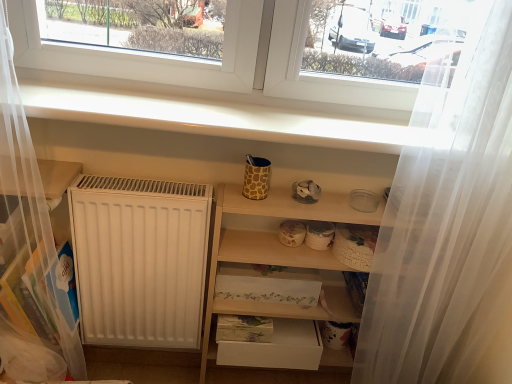
Question: Could you tell me if wooden shelves at center is facing white matte drawer at lower center?

Choices:
 (A) no
 (B) yes

Answer: (B)

Question: Does wooden shelves at center have a greater height compared to white matte drawer at lower center?

Choices:
 (A) yes
 (B) no

Answer: (A)

Question: Is wooden shelves at center placed right next to white matte drawer at lower center?

Choices:
 (A) yes
 (B) no

Answer: (B)

Question: Is wooden shelves at center positioned behind white matte drawer at lower center?

Choices:
 (A) yes
 (B) no

Answer: (B)

Question: Does wooden shelves at center appear on the left side of white matte drawer at lower center?

Choices:
 (A) no
 (B) yes

Answer: (A)

Question: Considering the positions of point (412, 215) and point (327, 203), is point (412, 215) closer or farther from the camera than point (327, 203)?

Choices:
 (A) closer
 (B) farther

Answer: (A)

Question: Is white sheer curtain at right taller or shorter than wooden shelves at center?

Choices:
 (A) short
 (B) tall

Answer: (B)

Question: From the image's perspective, is white sheer curtain at right located above or below wooden shelves at center?

Choices:
 (A) above
 (B) below

Answer: (A)

Question: Is white sheer curtain at right spatially inside wooden shelves at center, or outside of it?

Choices:
 (A) inside
 (B) outside

Answer: (B)

Question: From the image's perspective, relative to white smooth window sill at upper center, is wooden shelves at center above or below?

Choices:
 (A) above
 (B) below

Answer: (B)

Question: Is wooden shelves at center inside or outside of white smooth window sill at upper center?

Choices:
 (A) outside
 (B) inside

Answer: (A)

Question: Is wooden shelves at center taller or shorter than white smooth window sill at upper center?

Choices:
 (A) tall
 (B) short

Answer: (A)

Question: Is point (305, 205) closer or farther from the camera than point (259, 122)?

Choices:
 (A) farther
 (B) closer

Answer: (A)

Question: Considering their positions, is white sheer curtain at right located in front of or behind white matte drawer at lower center?

Choices:
 (A) behind
 (B) front

Answer: (B)

Question: Is point (389, 319) positioned closer to the camera than point (250, 342)?

Choices:
 (A) farther
 (B) closer

Answer: (B)